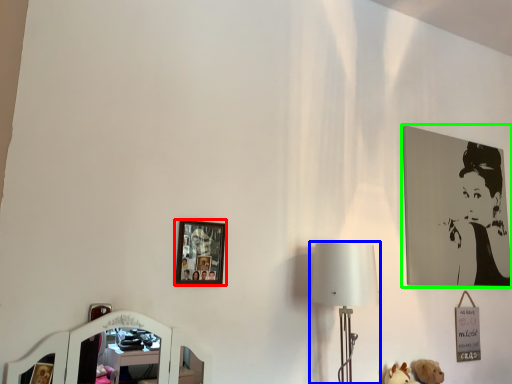
Question: Considering the real-world distances, which object is closest to picture frame (highlighted by a red box)? table lamp (highlighted by a blue box) or picture frame (highlighted by a green box).

Choices:
 (A) table lamp
 (B) picture frame

Answer: (A)